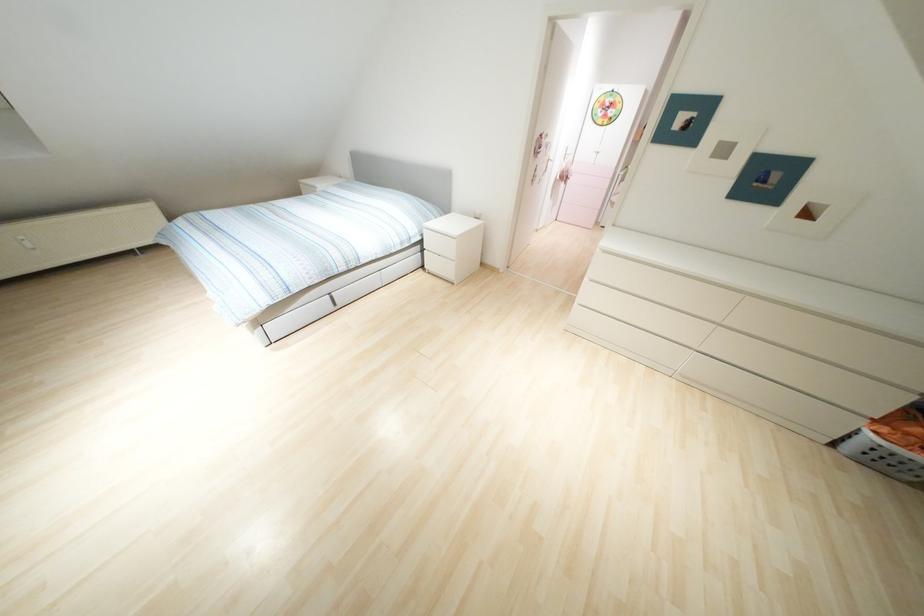
Where would you turn the radiator knob? Please return your answer as a coordinate pair (x, y).

(25, 241)